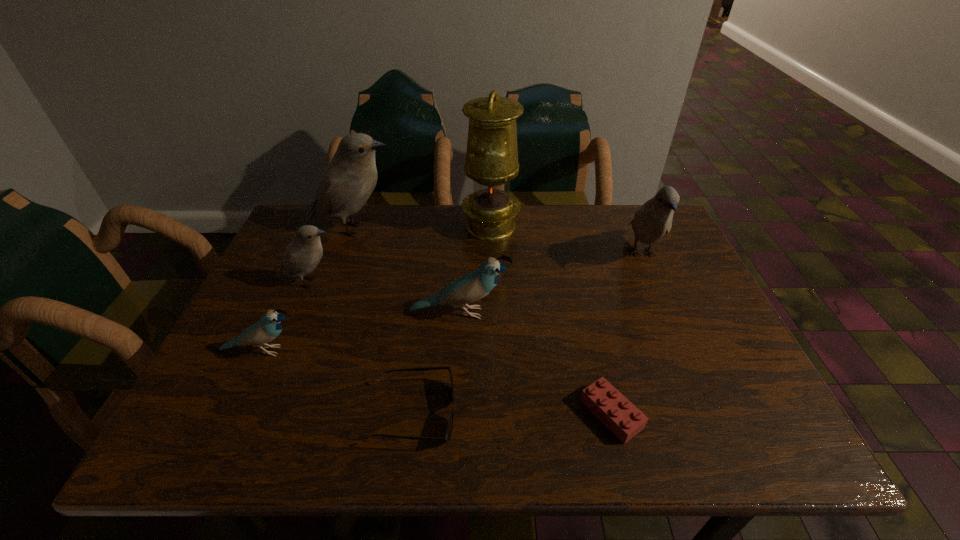
I want to click on vacant area situated on the left of the Lego, so click(x=404, y=414).

At what (x,y) coordinates should I click in order to perform the action: click on oil lamp that is at the far edge. Please return your answer as a coordinate pair (x, y). The image size is (960, 540). Looking at the image, I should click on (492, 154).

What are the coordinates of `sunglasses located in the near edge section of the desktop` in the screenshot? It's located at (447, 436).

Locate an element on the screen. The image size is (960, 540). Lego positioned at the near edge is located at coordinates (614, 410).

At what (x,y) coordinates should I click in order to perform the action: click on object that is positioned at the right edge. Please return your answer as a coordinate pair (x, y). The image size is (960, 540). Looking at the image, I should click on (654, 219).

Locate an element on the screen. The width and height of the screenshot is (960, 540). object at the far left corner is located at coordinates (348, 181).

At what (x,y) coordinates should I click in order to perform the action: click on object that is positioned at the far right corner. Please return your answer as a coordinate pair (x, y). This screenshot has height=540, width=960. Looking at the image, I should click on (654, 219).

I want to click on free space at the far edge of the desktop, so click(400, 233).

I want to click on vacant region at the near edge of the desktop, so click(x=516, y=449).

The width and height of the screenshot is (960, 540). What are the coordinates of `vacant area at the left edge of the desktop` in the screenshot? It's located at (320, 284).